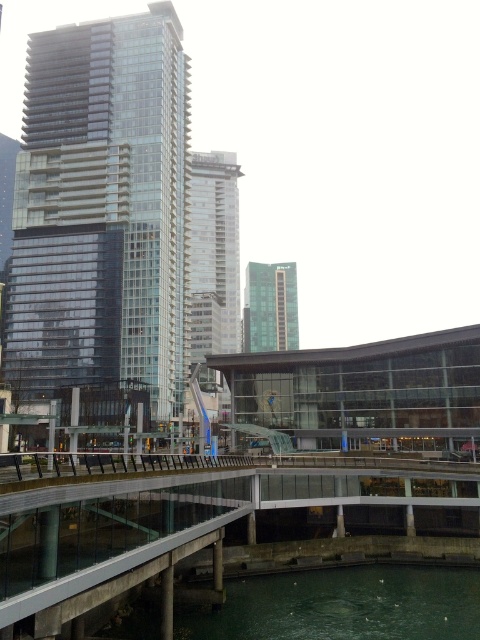
Which is behind, point (173, 8) or point (276, 276)?

Positioned behind is point (276, 276).

Can you confirm if glassy reflective skyscraper at left is wider than green glass building at center?

Indeed, glassy reflective skyscraper at left has a greater width compared to green glass building at center.

Is point (26, 195) less distant than point (288, 275)?

Yes, it is.

The height and width of the screenshot is (640, 480). Find the location of `glassy reflective skyscraper at left`. glassy reflective skyscraper at left is located at coordinates (118, 172).

Which is more to the right, concrete/gray pedestrian bridge at lower center or green glass building at center?

green glass building at center

Is point (188, 540) closer to viewer compared to point (256, 336)?

Yes, point (188, 540) is in front of point (256, 336).

Is point (7, 605) positioned before point (280, 320)?

Yes, point (7, 605) is closer to viewer.

Locate an element on the screen. concrete/gray pedestrian bridge at lower center is located at coordinates (180, 518).

Can you confirm if silver glass tower at center is taller than green glass building at center?

Yes.

Can you confirm if silver glass tower at center is positioned to the left of green glass building at center?

Yes, silver glass tower at center is to the left of green glass building at center.

Does point (231, 211) lie behind point (262, 269)?

No.

At what (x,y) coordinates should I click in order to perform the action: click on silver glass tower at center. Please return your answer as a coordinate pair (x, y). This screenshot has height=640, width=480. Looking at the image, I should click on (214, 262).